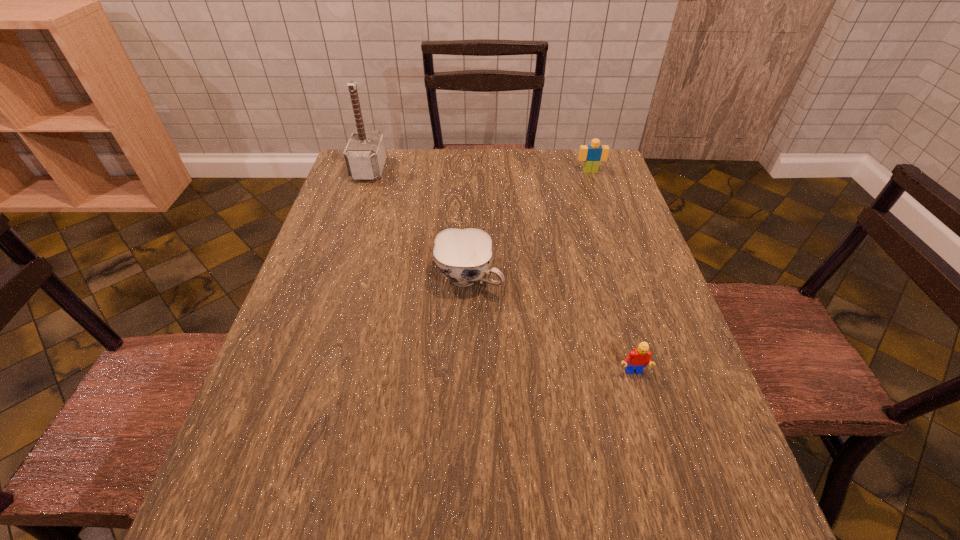
The height and width of the screenshot is (540, 960). Find the location of `free point located on the front-facing side of the nearest object`. free point located on the front-facing side of the nearest object is located at coordinates (668, 498).

You are a GUI agent. You are given a task and a screenshot of the screen. Output one action in this format:
    pyautogui.click(x=<x>, y=<y>)
    Task: Click on the hammer that is at the far edge
    The width and height of the screenshot is (960, 540).
    Given the screenshot: What is the action you would take?
    pyautogui.click(x=365, y=154)

I want to click on Lego located in the far edge section of the desktop, so click(592, 154).

Where is `object at the left edge`? This screenshot has height=540, width=960. object at the left edge is located at coordinates (365, 154).

Where is `object located at the far left corner`? This screenshot has width=960, height=540. object located at the far left corner is located at coordinates (x=365, y=154).

At what (x,y) coordinates should I click in order to perform the action: click on object that is at the far right corner. Please return your answer as a coordinate pair (x, y). The width and height of the screenshot is (960, 540). Looking at the image, I should click on (592, 154).

Locate an element on the screen. vacant space at the far edge is located at coordinates (533, 171).

The height and width of the screenshot is (540, 960). I want to click on vacant space at the left edge of the desktop, so click(313, 260).

In the image, there is a desktop. In order to click on vacant space at the right edge in this screenshot , I will do `click(590, 224)`.

Image resolution: width=960 pixels, height=540 pixels. In order to click on free space at the far right corner of the desktop in this screenshot , I will do `click(599, 171)`.